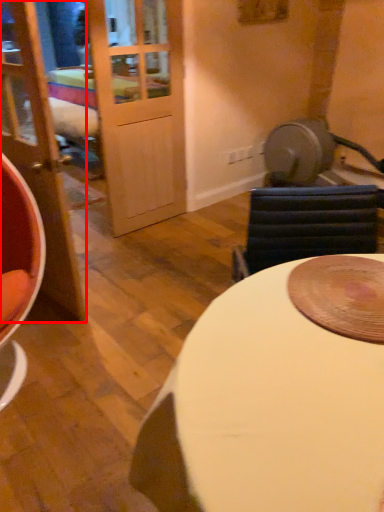
Question: From the image's perspective, where is door (annotated by the red box) located in relation to table in the image?

Choices:
 (A) above
 (B) below

Answer: (A)